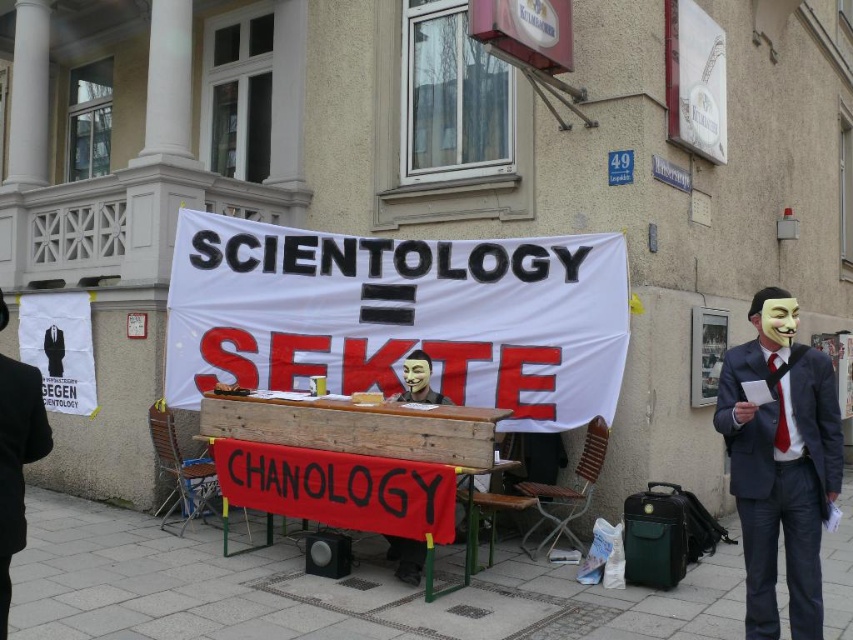
Question: Can you confirm if matte black suit at right is positioned above black suit at center?

Choices:
 (A) no
 (B) yes

Answer: (A)

Question: Does matte black suit at right appear on the left side of black suit at center?

Choices:
 (A) no
 (B) yes

Answer: (A)

Question: Can you confirm if matte black suit at right is wider than black suit at center?

Choices:
 (A) no
 (B) yes

Answer: (B)

Question: Which point is farther to the camera?

Choices:
 (A) black suit at center
 (B) matte black suit at right

Answer: (B)